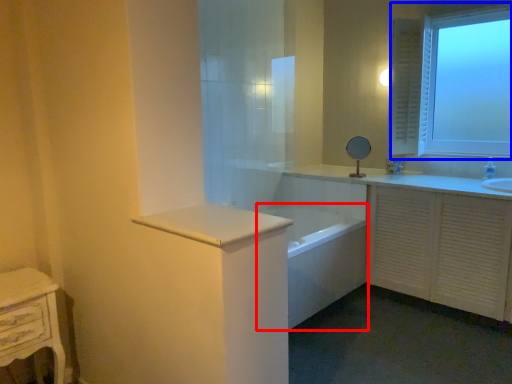
Question: Which object appears farthest to the camera in this image, bath (highlighted by a red box) or window (highlighted by a blue box)?

Choices:
 (A) bath
 (B) window

Answer: (B)